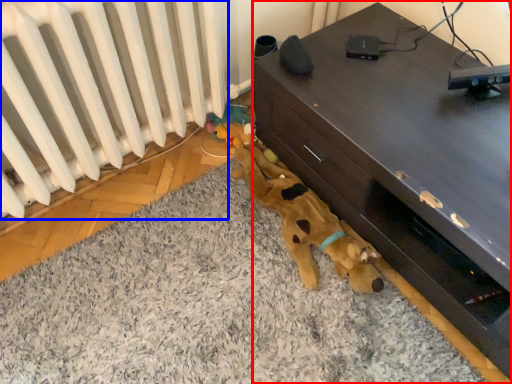
Question: Which object is closer to the camera taking this photo, furniture (highlighted by a red box) or radiator (highlighted by a blue box)?

Choices:
 (A) furniture
 (B) radiator

Answer: (B)